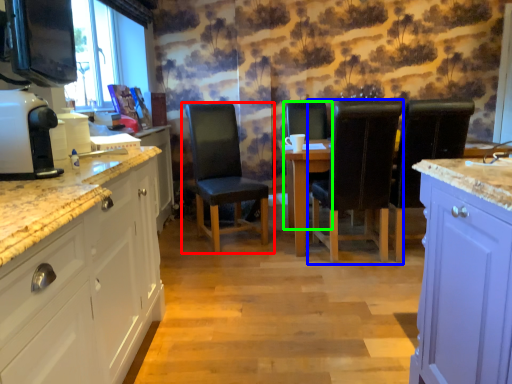
Question: Which object is the closest to the chair (highlighted by a red box)? Choose among these: chair (highlighted by a blue box) or chair (highlighted by a green box).

Choices:
 (A) chair
 (B) chair

Answer: (A)